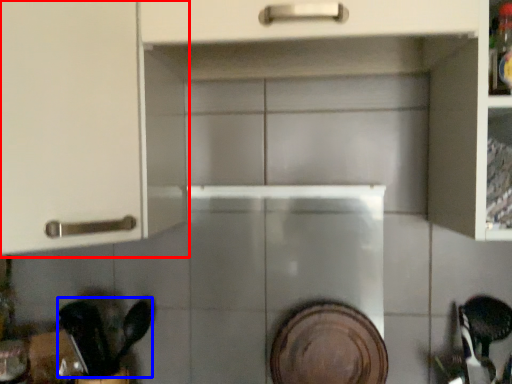
Question: Among these objects, which one is farthest to the camera, cabinetry (highlighted by a red box) or tableware (highlighted by a blue box)?

Choices:
 (A) cabinetry
 (B) tableware

Answer: (B)